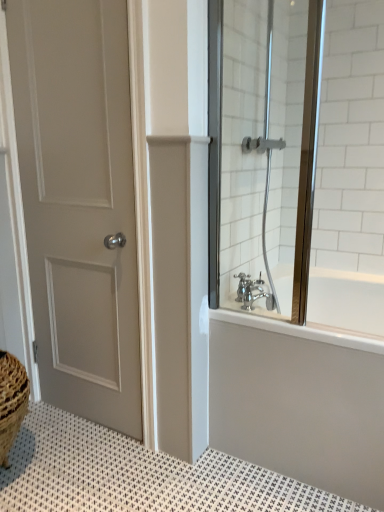
I want to click on free point in front of matte gray door at left, so click(86, 464).